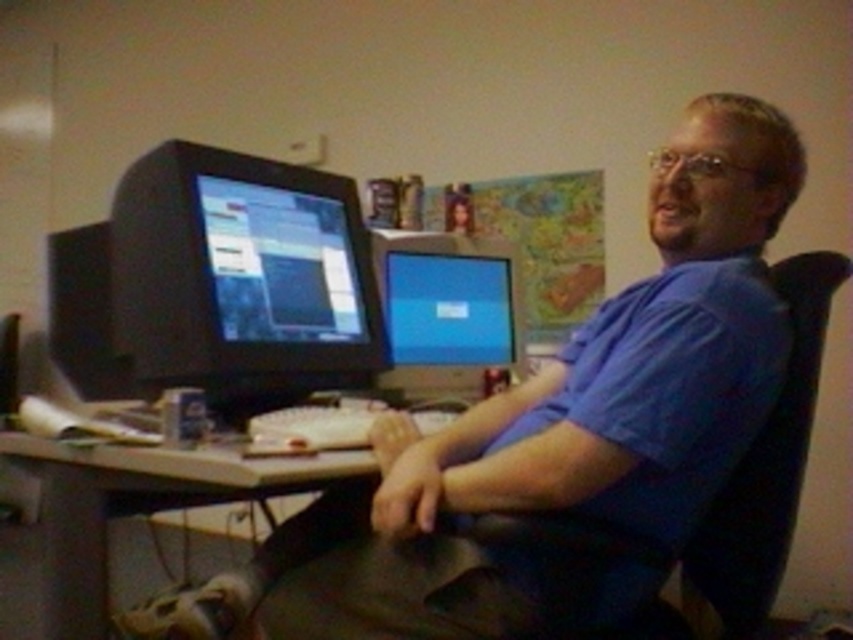
Question: Does blue matte shirt at center have a larger size compared to matte black monitor at center?

Choices:
 (A) yes
 (B) no

Answer: (A)

Question: Considering the real-world distances, which object is closest to the matte black monitor at left?

Choices:
 (A) wooden desk at center
 (B) matte black monitor at center

Answer: (A)

Question: Does blue matte shirt at center appear under matte black monitor at left?

Choices:
 (A) yes
 (B) no

Answer: (A)

Question: Among these points, which one is farthest from the camera?

Choices:
 (A) (329, 252)
 (B) (431, 260)
 (C) (587, 474)
 (D) (80, 454)

Answer: (B)

Question: Considering the real-world distances, which object is closest to the matte black monitor at left?

Choices:
 (A) blue matte shirt at center
 (B) wooden desk at center
 (C) matte black monitor at center

Answer: (B)

Question: Is blue matte shirt at center wider than matte black monitor at left?

Choices:
 (A) no
 (B) yes

Answer: (B)